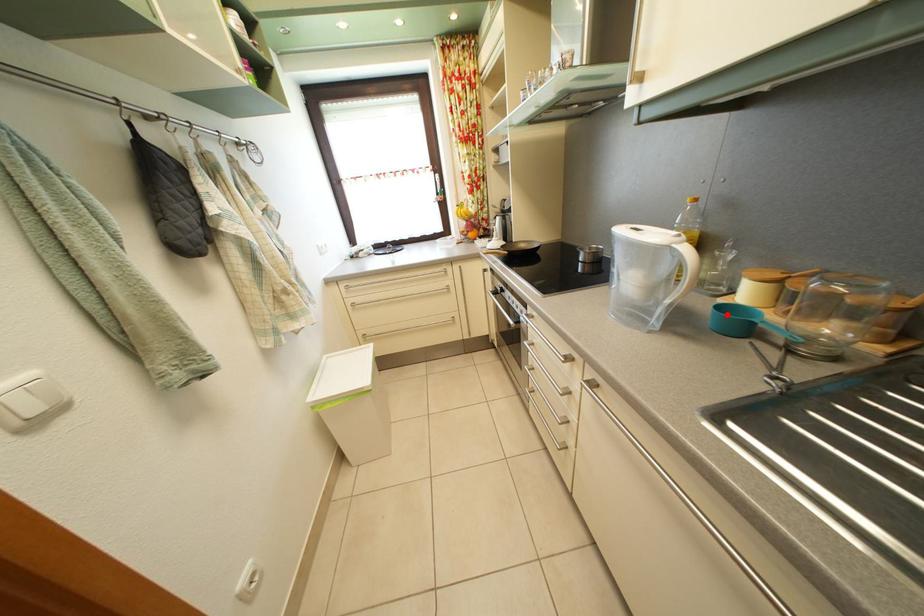
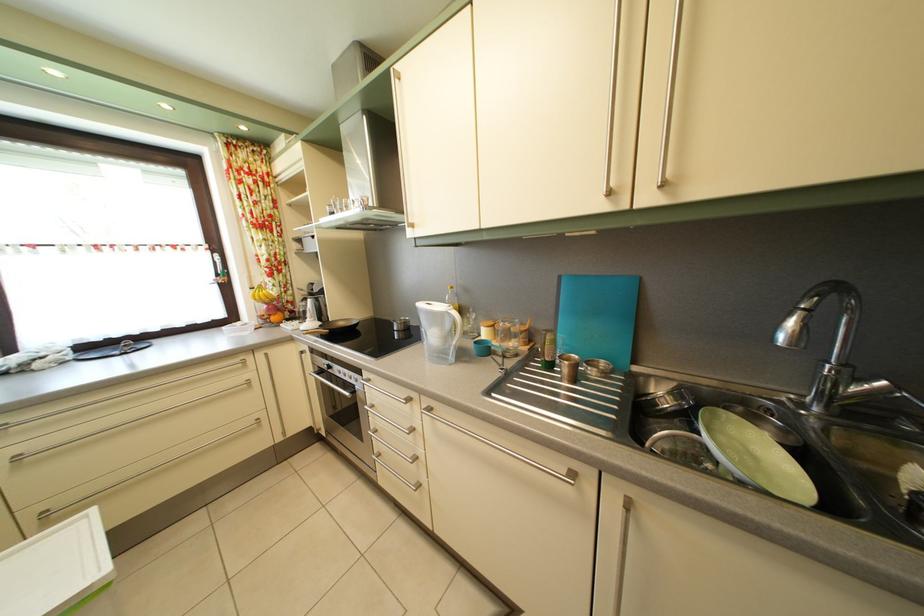
The point at the highlighted location is marked in the first image. Where is the corresponding point in the second image?

(483, 350)